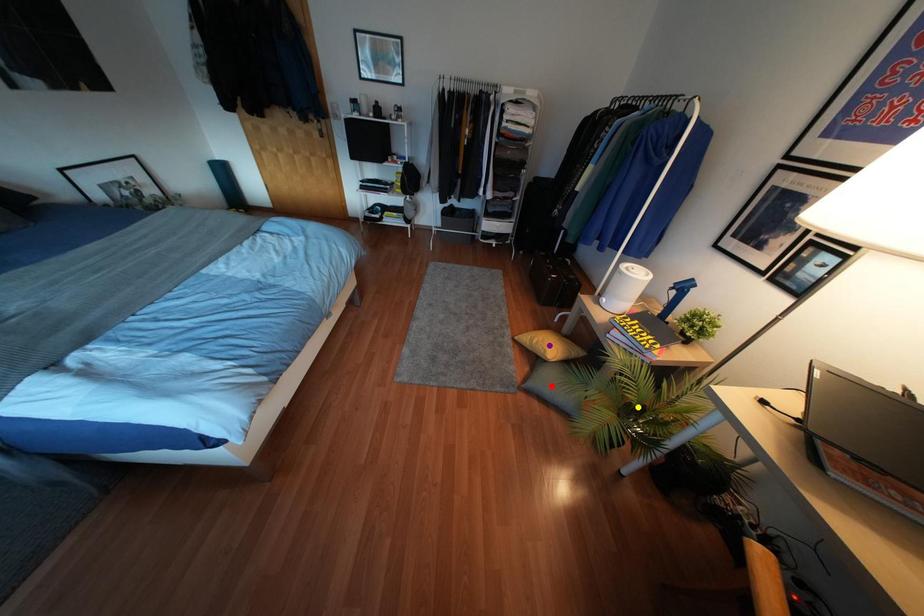
Order these from nearest to farthest:
- yellow point
- purple point
- red point

1. purple point
2. red point
3. yellow point